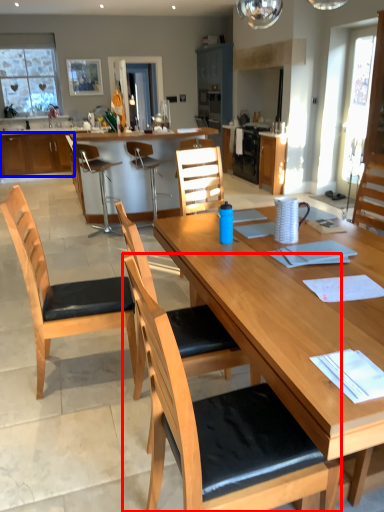
Question: Which point is further to the camera, chair (highlighted by a red box) or cabinetry (highlighted by a blue box)?

Choices:
 (A) chair
 (B) cabinetry

Answer: (B)